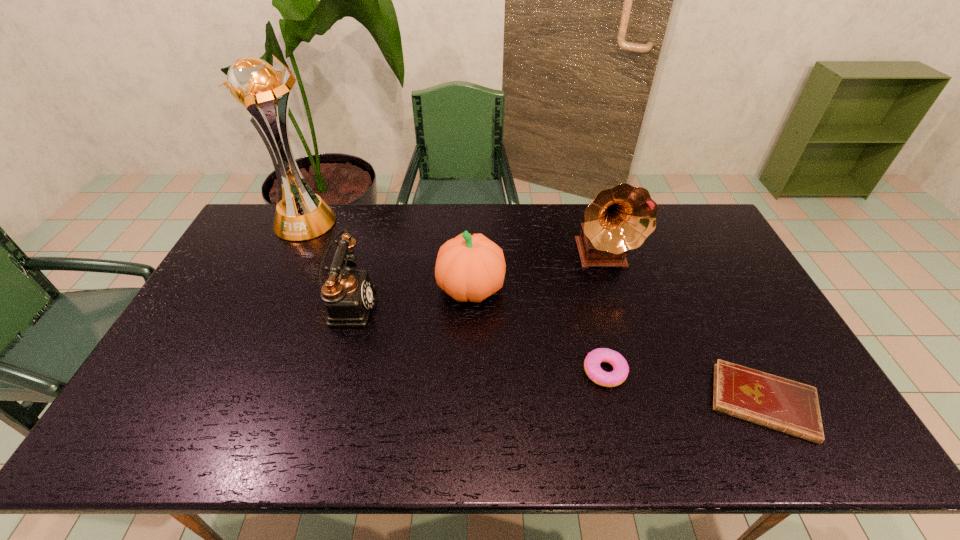
This screenshot has width=960, height=540. Identify the location of vacant space located on the right of the pumpkin. (563, 288).

Locate an element on the screen. Image resolution: width=960 pixels, height=540 pixels. vacant space located 0.060m on the front of the telephone at the rotary dial is located at coordinates (396, 305).

I want to click on vacant space situated on the right of the doughnut, so click(676, 372).

Locate an element on the screen. The width and height of the screenshot is (960, 540). free space located on the back of the notebook is located at coordinates (707, 292).

Locate an element on the screen. trophy located at the far edge is located at coordinates (254, 85).

The height and width of the screenshot is (540, 960). What are the coordinates of `phonograph_record at the far edge` in the screenshot? It's located at (619, 219).

Where is `object that is at the near edge`? The height and width of the screenshot is (540, 960). object that is at the near edge is located at coordinates (771, 401).

This screenshot has width=960, height=540. Find the location of `object present at the left edge`. object present at the left edge is located at coordinates (254, 85).

In order to click on object that is at the right edge in this screenshot , I will do `click(771, 401)`.

At what (x,y) coordinates should I click in order to perform the action: click on object positioned at the far left corner. Please return your answer as a coordinate pair (x, y). The height and width of the screenshot is (540, 960). Looking at the image, I should click on (254, 85).